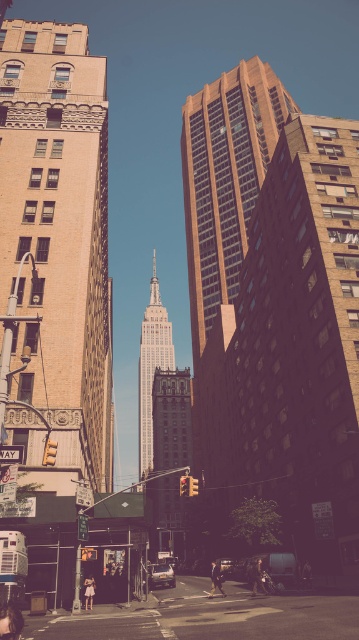
Question: Which of the following is the farthest from the observer?

Choices:
 (A) (170, 576)
 (B) (258, 561)
 (C) (146, 365)
 (D) (235, 221)

Answer: (C)

Question: Can you confirm if white marble tower at center is positioned to the left of white cotton dress at lower center?

Choices:
 (A) no
 (B) yes

Answer: (B)

Question: Based on their relative distances, which object is nearer to the beige stone building at left?

Choices:
 (A) brick textured building at center
 (B) white marble tower at center

Answer: (A)

Question: Does beige stone building at left appear on the left side of white marble tower at center?

Choices:
 (A) no
 (B) yes

Answer: (A)

Question: Can you confirm if brick textured building at center is bigger than dark brown leather jacket at lower center?

Choices:
 (A) no
 (B) yes

Answer: (B)

Question: Which of the following is the farthest from the observer?

Choices:
 (A) (141, 371)
 (B) (91, 604)

Answer: (A)